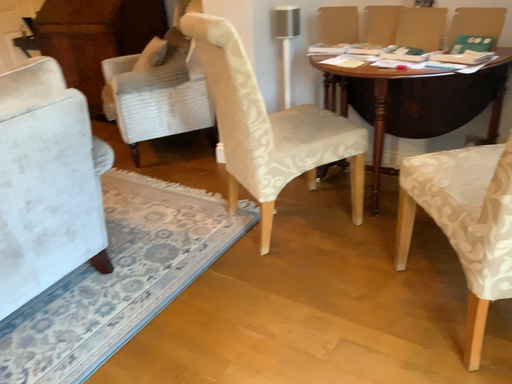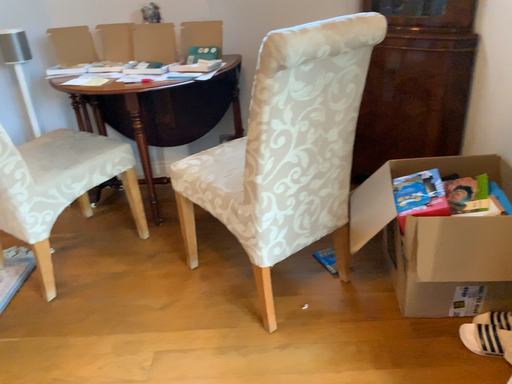
Question: Which way did the camera rotate in the video?

Choices:
 (A) rotated upward
 (B) rotated downward

Answer: (A)